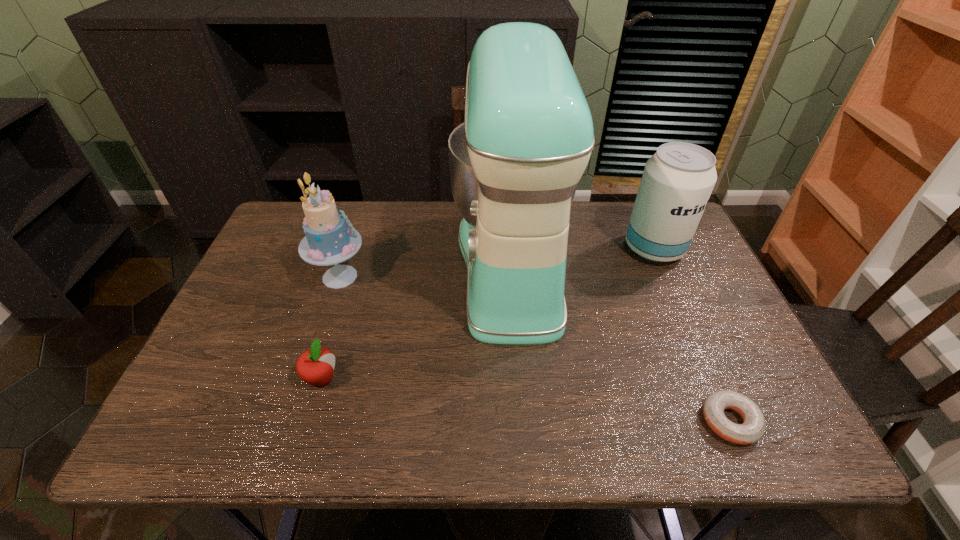
At what (x,y) coordinates should I click in order to perform the action: click on mixer. Please return your answer as a coordinate pair (x, y). The image size is (960, 540). Looking at the image, I should click on (527, 137).

Identify the location of the tallest object. This screenshot has height=540, width=960. (527, 137).

Find the location of a particular element. cake is located at coordinates (330, 238).

The height and width of the screenshot is (540, 960). Identify the location of alcohol. (677, 181).

This screenshot has height=540, width=960. Identify the location of the second shortest object. (315, 366).

Image resolution: width=960 pixels, height=540 pixels. I want to click on apple, so click(x=315, y=366).

Find the location of `doughnut`. doughnut is located at coordinates coord(752,430).

Identify the location of the shortest object. (752, 430).

Identify the location of vacant space situated at the base of the third object from left to right. (334, 265).

Locate an element on the screen. The height and width of the screenshot is (540, 960). vacant area situated 0.060m at the base of the third object from left to right is located at coordinates (431, 265).